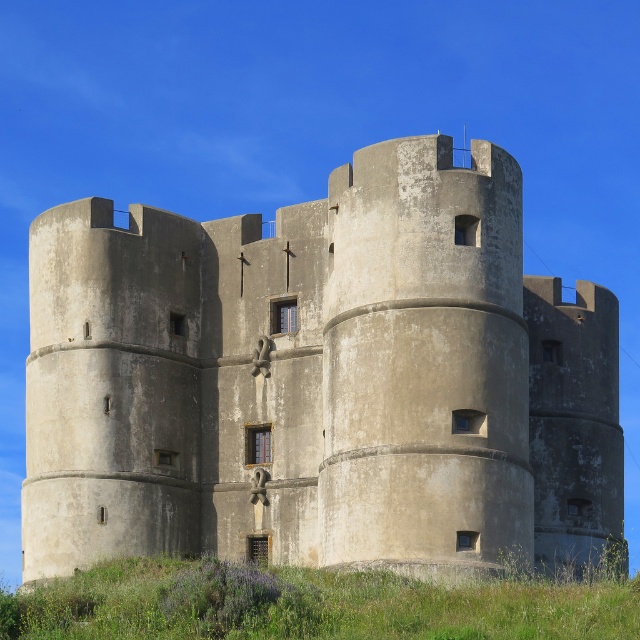
Does beige stone castle at center appear on the left side of green grass at lower center?

Correct, you'll find beige stone castle at center to the left of green grass at lower center.

This screenshot has height=640, width=640. Find the location of `beige stone castle at center`. beige stone castle at center is located at coordinates (320, 380).